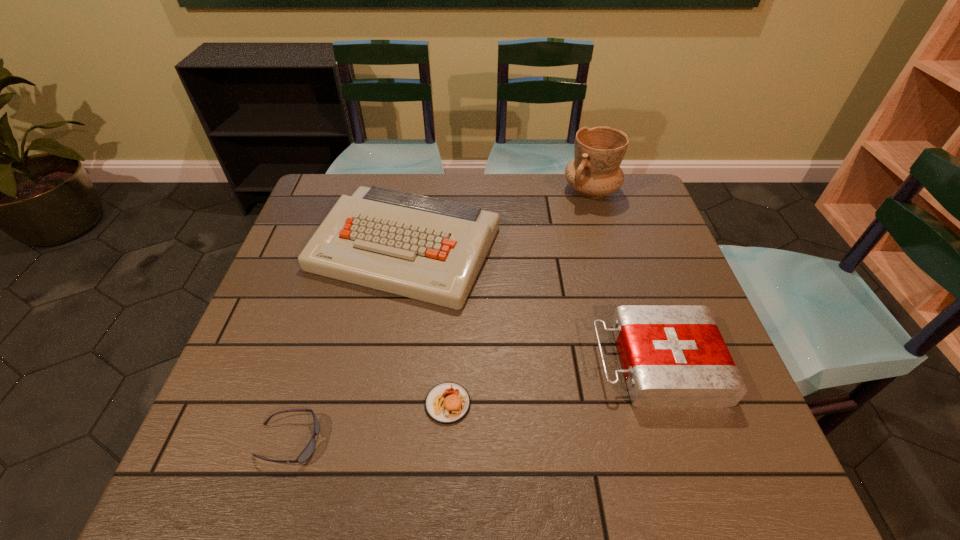
Image resolution: width=960 pixels, height=540 pixels. I want to click on object present at the near left corner, so click(x=308, y=451).

You are a GUI agent. You are given a task and a screenshot of the screen. Output one action in this format:
    pyautogui.click(x=<x>, y=<y>)
    Task: Click on the object located in the far right corner section of the desktop
    The width and height of the screenshot is (960, 540).
    Given the screenshot: What is the action you would take?
    pyautogui.click(x=595, y=171)

At what (x,y) coordinates should I click in order to perform the action: click on vacant area at the far edge. Please return your answer as a coordinate pair (x, y). Looking at the image, I should click on 470,200.

Identify the location of vacant position at the near edge of the desktop. This screenshot has width=960, height=540. (385, 443).

In the image, there is a desktop. At what (x,y) coordinates should I click in order to perform the action: click on free region at the left edge. Please return your answer as a coordinate pair (x, y). The height and width of the screenshot is (540, 960). Looking at the image, I should click on (282, 435).

The width and height of the screenshot is (960, 540). In the image, there is a desktop. Find the location of `free space at the far left corner`. free space at the far left corner is located at coordinates (312, 193).

I want to click on vacant area at the far right corner of the desktop, so click(x=634, y=177).

What are the coordinates of `free space between the computer keyboard and the fourth tallest object` in the screenshot? It's located at (426, 326).

The height and width of the screenshot is (540, 960). I want to click on vacant area that lies between the patty and the first-aid kit, so pos(552,383).

At what (x,y) coordinates should I click in order to perform the action: click on vacant region between the sunglasses and the first-aid kit. Please return your answer as a coordinate pair (x, y). Image resolution: width=960 pixels, height=540 pixels. Looking at the image, I should click on (472, 402).